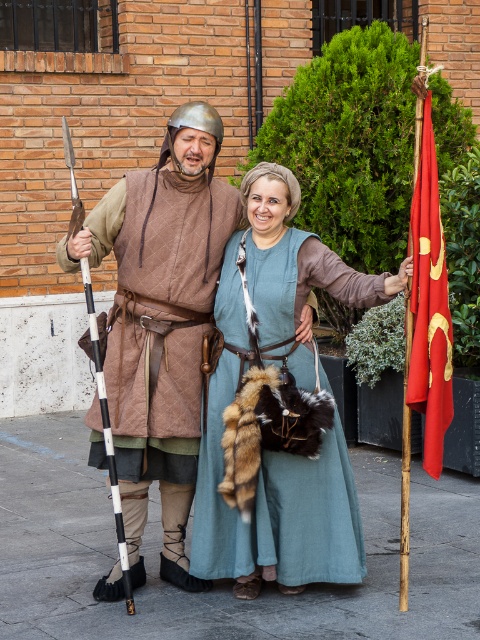
Looking at the historical scene, there are two people dressed in period clothing. The first person is wearing a quilted brown vest at left, and the second is wearing a teal linen dress at center. From the perspective of an observer standing in front of the brick building, which clothing item is positioned farther to the left?

The quilted brown vest at left is positioned farther to the left compared to the teal linen dress at center, as it is located to the left of the dress.

You are a photographer trying to capture both the quilted brown vest at left and the teal linen dress at center in a single shot. Based on their positions, which one is closer to the camera?

The quilted brown vest at left is closer to the camera since the teal linen dress at center is positioned behind it.